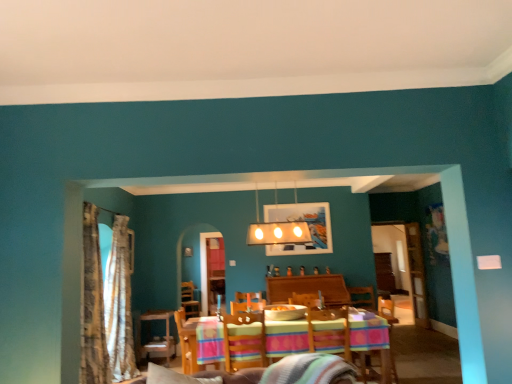
Question: Does wooden table at center contain multicolored fabric armchair at center, the second armchair positioned from the right?

Choices:
 (A) yes
 (B) no

Answer: (B)

Question: From a real-world perspective, is wooden table at center on top of multicolored fabric armchair at center, the second armchair positioned from the right?

Choices:
 (A) yes
 (B) no

Answer: (B)

Question: From a real-world perspective, is wooden table at center under multicolored fabric armchair at center, the second armchair positioned from the right?

Choices:
 (A) no
 (B) yes

Answer: (B)

Question: Considering the relative positions of wooden table at center and multicolored fabric armchair at center, the second armchair positioned from the right, in the image provided, is wooden table at center behind multicolored fabric armchair at center, the second armchair positioned from the right,?

Choices:
 (A) no
 (B) yes

Answer: (B)

Question: Are wooden table at center and multicolored fabric armchair at center, the first armchair positioned from the left, located far from each other?

Choices:
 (A) no
 (B) yes

Answer: (A)

Question: Could you tell me if wooden table at center is facing multicolored fabric armchair at center, the second armchair positioned from the right?

Choices:
 (A) yes
 (B) no

Answer: (B)

Question: Does wooden table with striped tablecloth at center have a lesser width compared to white glossy light fixture at upper center?

Choices:
 (A) no
 (B) yes

Answer: (A)

Question: Is wooden table with striped tablecloth at center positioned in front of white glossy light fixture at upper center?

Choices:
 (A) yes
 (B) no

Answer: (A)

Question: From a real-world perspective, is wooden table with striped tablecloth at center beneath white glossy light fixture at upper center?

Choices:
 (A) yes
 (B) no

Answer: (A)

Question: Is wooden table with striped tablecloth at center to the left of white glossy light fixture at upper center from the viewer's perspective?

Choices:
 (A) yes
 (B) no

Answer: (B)

Question: Can you confirm if wooden table with striped tablecloth at center is positioned to the right of white glossy light fixture at upper center?

Choices:
 (A) yes
 (B) no

Answer: (A)

Question: Is wooden table with striped tablecloth at center bigger than white glossy light fixture at upper center?

Choices:
 (A) yes
 (B) no

Answer: (A)

Question: Is gold textured curtain at left, acting as the 1th curtain starting from the back, facing away from metallic silver picture frame at center?

Choices:
 (A) no
 (B) yes

Answer: (A)